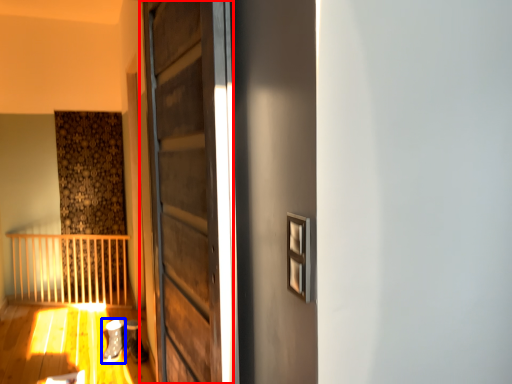
Question: Which object is further to the camera taking this photo, door (highlighted by a red box) or shoe (highlighted by a blue box)?

Choices:
 (A) door
 (B) shoe

Answer: (B)